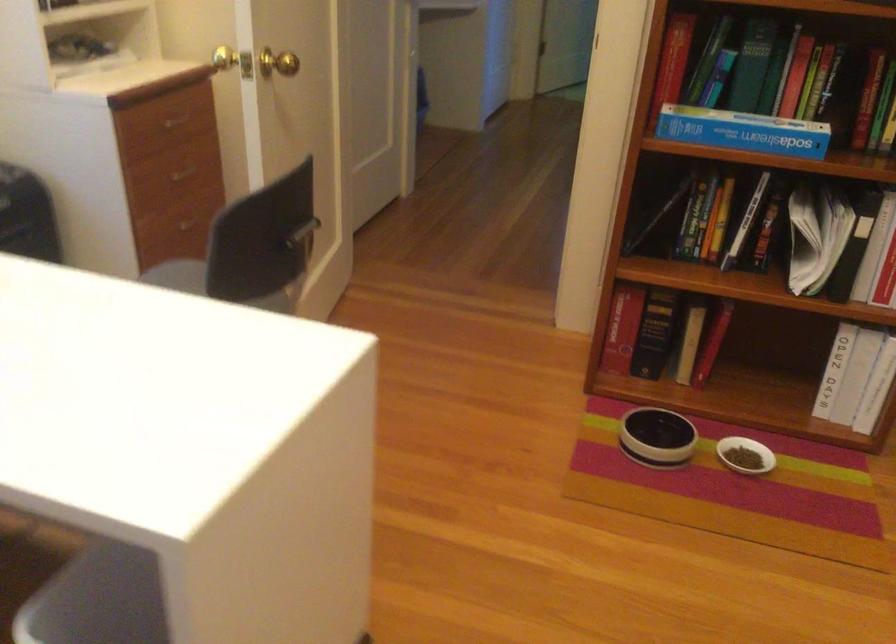
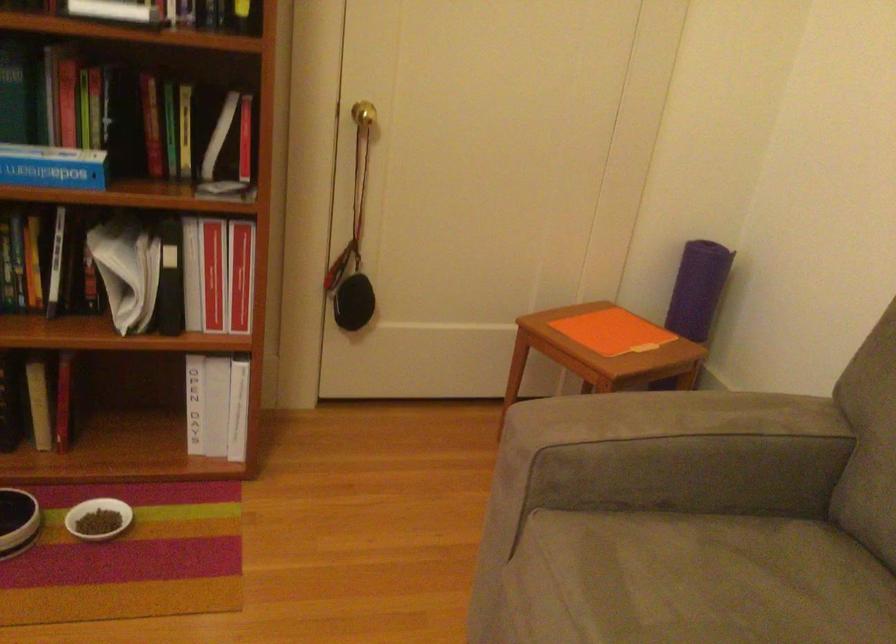
Question: The camera is either moving clockwise (left) or counter-clockwise (right) around the object. The first image is from the beginning of the video and the second image is from the end. Is the camera moving left or right when shooting the video?

Choices:
 (A) Left
 (B) Right

Answer: (A)